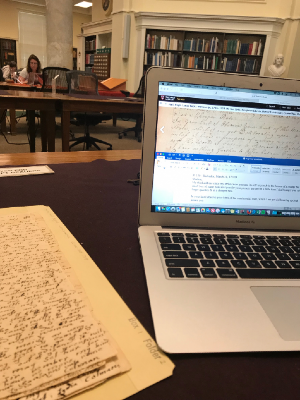
Find the location of `folder`. folder is located at coordinates (115, 312).